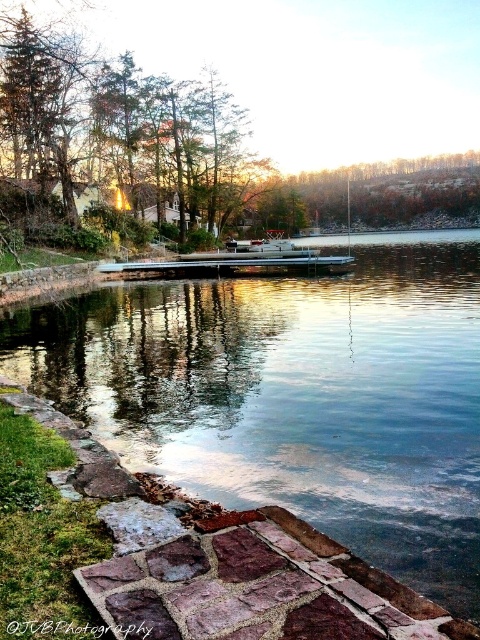
Question: Does rustic stone path at lower center have a lesser width compared to white plastic boat at center?

Choices:
 (A) no
 (B) yes

Answer: (B)

Question: Can you confirm if rustic stone path at lower center is smaller than white plastic boat at center?

Choices:
 (A) no
 (B) yes

Answer: (B)

Question: Is rustic stone path at lower center bigger than white plastic boat at center?

Choices:
 (A) yes
 (B) no

Answer: (B)

Question: Which point is farther from the camera taking this photo?

Choices:
 (A) (245, 253)
 (B) (177, 568)

Answer: (A)